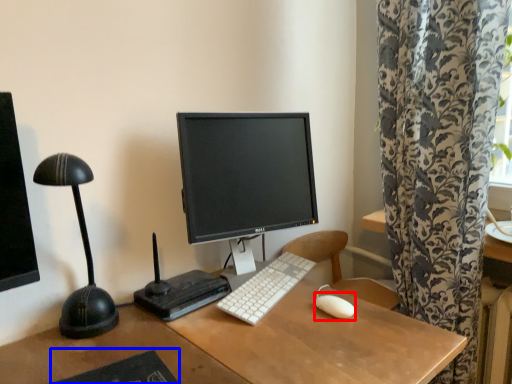
Question: Which object is closer to the camera taking this photo, mouse (highlighted by a red box) or mousepad (highlighted by a blue box)?

Choices:
 (A) mouse
 (B) mousepad

Answer: (B)